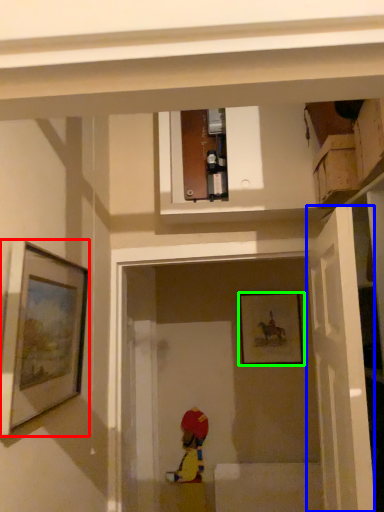
Question: Which is farther away from picture frame (highlighted by a red box)? door (highlighted by a blue box) or picture frame (highlighted by a green box)?

Choices:
 (A) door
 (B) picture frame

Answer: (B)